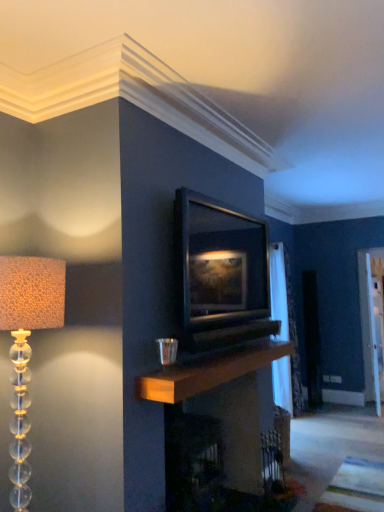
Question: Is matte black picture frame at center surrounded by translucent glass lampshade at left?

Choices:
 (A) no
 (B) yes

Answer: (A)

Question: Would you say translucent glass lampshade at left is a long distance from matte black picture frame at center?

Choices:
 (A) no
 (B) yes

Answer: (B)

Question: Is translucent glass lampshade at left shorter than matte black picture frame at center?

Choices:
 (A) yes
 (B) no

Answer: (B)

Question: Does translucent glass lampshade at left turn towards matte black picture frame at center?

Choices:
 (A) yes
 (B) no

Answer: (B)

Question: From the image's perspective, is translucent glass lampshade at left above matte black picture frame at center?

Choices:
 (A) no
 (B) yes

Answer: (A)

Question: Is transparent glass door at right taller or shorter than matte black picture frame at center?

Choices:
 (A) tall
 (B) short

Answer: (A)

Question: From the image's perspective, relative to matte black picture frame at center, is transparent glass door at right above or below?

Choices:
 (A) below
 (B) above

Answer: (A)

Question: Considering the positions of transparent glass door at right and matte black picture frame at center in the image, is transparent glass door at right wider or thinner than matte black picture frame at center?

Choices:
 (A) wide
 (B) thin

Answer: (B)

Question: Is transparent glass door at right in front of or behind matte black picture frame at center in the image?

Choices:
 (A) front
 (B) behind

Answer: (B)

Question: In the image, is white sheer curtain at right on the left side or the right side of matte black picture frame at center?

Choices:
 (A) right
 (B) left

Answer: (A)

Question: In terms of size, does white sheer curtain at right appear bigger or smaller than matte black picture frame at center?

Choices:
 (A) big
 (B) small

Answer: (A)

Question: Is white sheer curtain at right inside or outside of matte black picture frame at center?

Choices:
 (A) outside
 (B) inside

Answer: (A)

Question: Is point (273, 317) closer or farther from the camera than point (274, 328)?

Choices:
 (A) farther
 (B) closer

Answer: (A)

Question: Is translucent glass lampshade at left taller or shorter than matte black picture frame at center?

Choices:
 (A) short
 (B) tall

Answer: (B)

Question: From the image's perspective, is translucent glass lampshade at left located above or below matte black picture frame at center?

Choices:
 (A) below
 (B) above

Answer: (A)